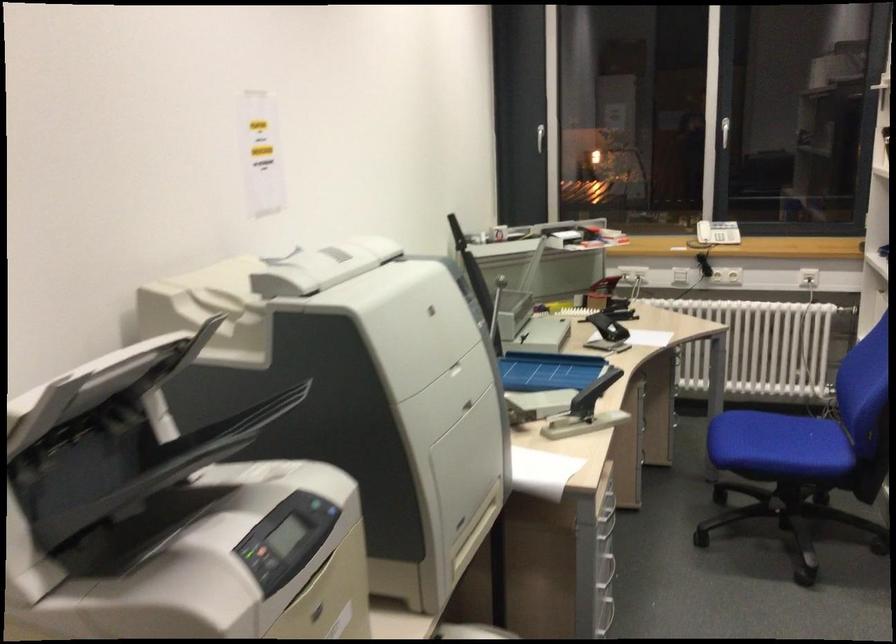
Locate an element on the screen. This screenshot has width=896, height=644. black stapler is located at coordinates (586, 410).